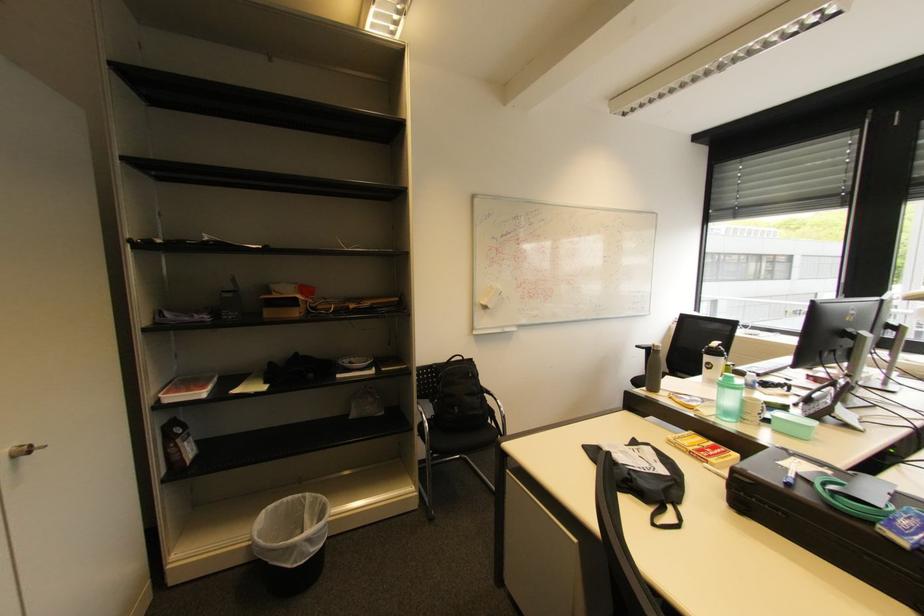
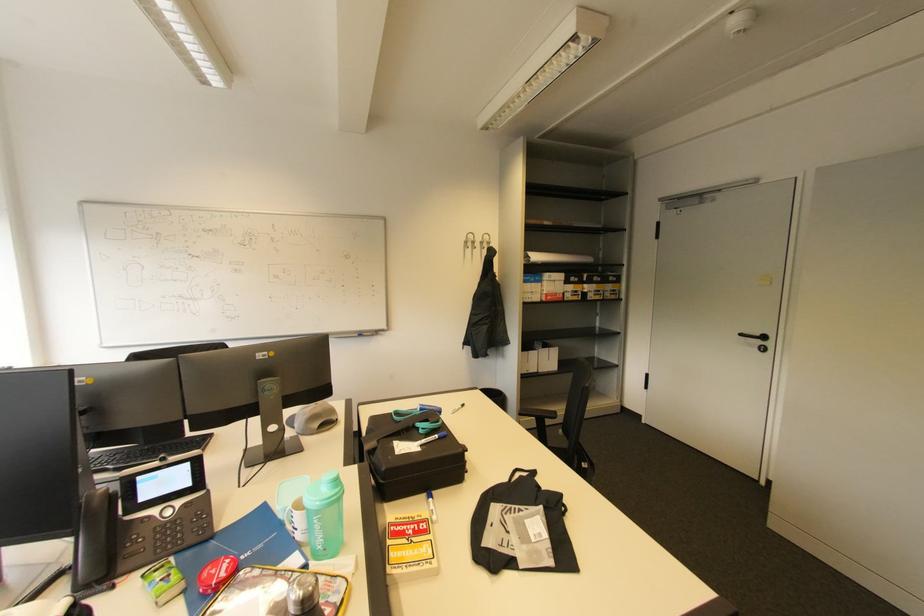
The point at (795,476) is marked in the first image. Where is the corresponding point in the second image?

(441, 437)